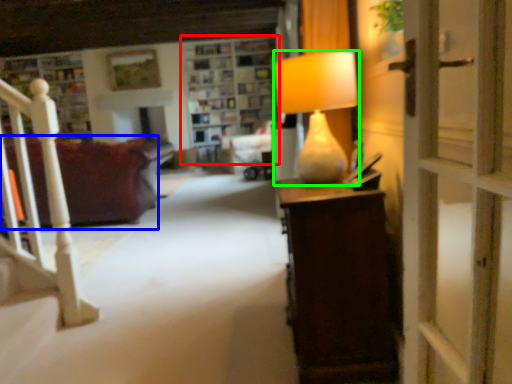
Question: Which object is the closest to the shelf (highlighted by a red box)? Choose among these: studio couch (highlighted by a blue box) or lamp (highlighted by a green box).

Choices:
 (A) studio couch
 (B) lamp

Answer: (A)